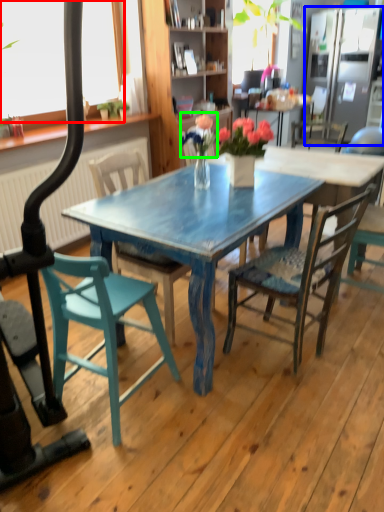
Question: Considering the real-world distances, which object is farthest from window screen (highlighted by a red box)? refrigerator (highlighted by a blue box) or flower (highlighted by a green box)?

Choices:
 (A) refrigerator
 (B) flower

Answer: (A)